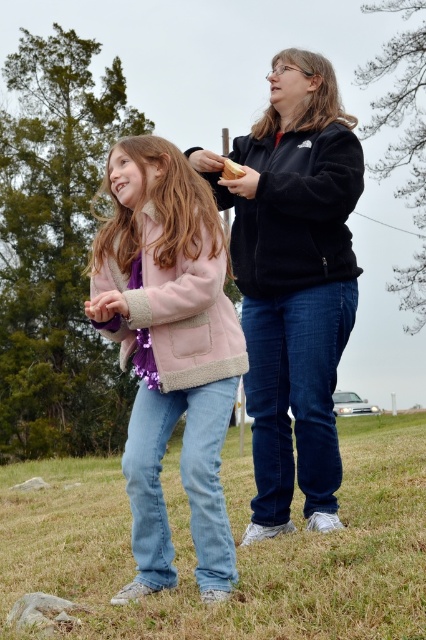
Question: Does blue jeans at lower center appear on the right side of black fleece jacket at center?

Choices:
 (A) no
 (B) yes

Answer: (A)

Question: Does black fleece jacket at center appear on the left side of slightly toasted bread at upper center?

Choices:
 (A) no
 (B) yes

Answer: (A)

Question: Is blue jeans at lower center above slightly toasted bread at upper center?

Choices:
 (A) no
 (B) yes

Answer: (A)

Question: Which object is positioned closest to the pink fleece jacket at center?

Choices:
 (A) blue jeans at lower center
 (B) slightly toasted bread at upper center
 (C) black fleece jacket at center

Answer: (C)

Question: Which point is closer to the camera taking this photo?

Choices:
 (A) (155, 170)
 (B) (310, 144)
 (C) (233, 166)
 (D) (397, 472)

Answer: (A)

Question: Estimate the real-world distances between objects in this image. Which object is farther from the blue jeans at lower center?

Choices:
 (A) slightly toasted bread at upper center
 (B) black fleece jacket at center
 (C) pink fleece jacket at center

Answer: (A)